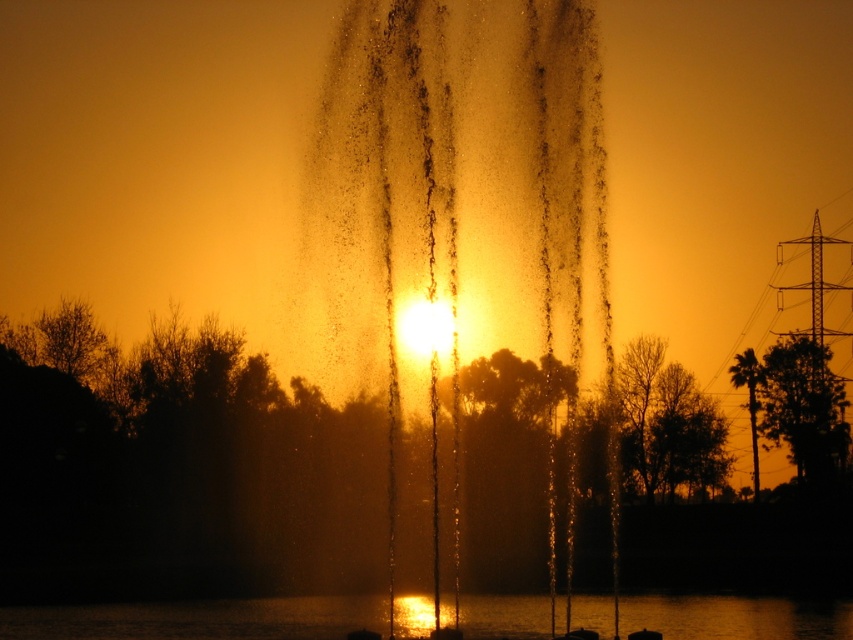
Is translucent water at center below transparent liquid water at center?

No.

Locate an element on the screen. This screenshot has width=853, height=640. translucent water at center is located at coordinates (383, 209).

Between point (567, 413) and point (595, 625), which one is positioned in front?

Point (595, 625) is in front.

Locate an element on the screen. Image resolution: width=853 pixels, height=640 pixels. translucent water at center is located at coordinates (383, 209).